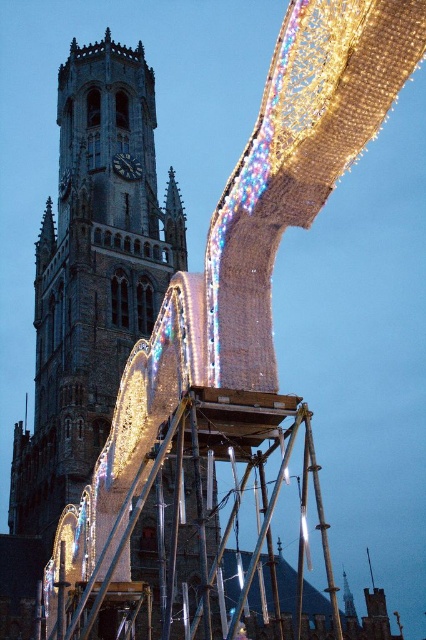
Question: Can you confirm if brick tower at center is positioned to the right of dark gray wooden clock at center-left?

Choices:
 (A) yes
 (B) no

Answer: (A)

Question: Is brick tower at center thinner than dark gray wooden clock at center-left?

Choices:
 (A) no
 (B) yes

Answer: (A)

Question: Which object appears farthest from the camera in this image?

Choices:
 (A) brick tower at center
 (B) dark gray wooden clock at center-left

Answer: (B)

Question: Which point is closer to the camera?

Choices:
 (A) brick tower at center
 (B) dark gray wooden clock at center-left

Answer: (A)

Question: Is brick tower at center smaller than dark gray wooden clock at center-left?

Choices:
 (A) yes
 (B) no

Answer: (B)